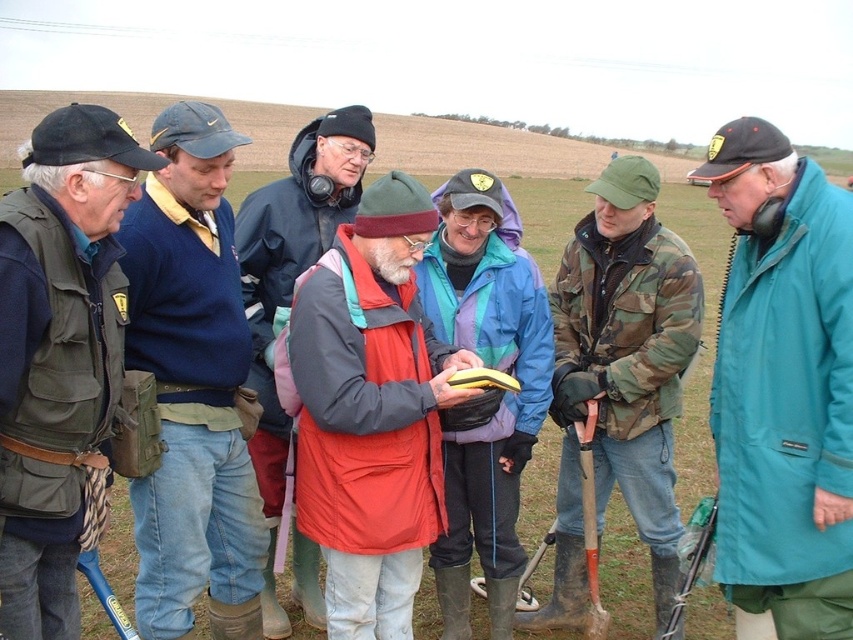
Does matte green vest at left come behind blue sweater at left?

No, matte green vest at left is in front of blue sweater at left.

Is point (51, 243) in front of point (161, 182)?

Yes, point (51, 243) is in front of point (161, 182).

The height and width of the screenshot is (640, 853). I want to click on matte green vest at left, so click(x=61, y=358).

Who is positioned more to the right, red matte jacket at center or camouflage jacket at center?

Positioned to the right is camouflage jacket at center.

Can you confirm if red matte jacket at center is shorter than camouflage jacket at center?

Correct, red matte jacket at center is not as tall as camouflage jacket at center.

Describe the element at coordinates (370, 412) in the screenshot. I see `red matte jacket at center` at that location.

Where is `red matte jacket at center`? red matte jacket at center is located at coordinates (370, 412).

Is teal waterproof jacket at center further to camera compared to blue sweater at left?

No, teal waterproof jacket at center is in front of blue sweater at left.

Is teal waterproof jacket at center wider than blue sweater at left?

Yes.

From the picture: Who is more distant from viewer, (776, 211) or (126, 234)?

Positioned behind is point (126, 234).

Where is `teal waterproof jacket at center`? The height and width of the screenshot is (640, 853). teal waterproof jacket at center is located at coordinates (782, 385).